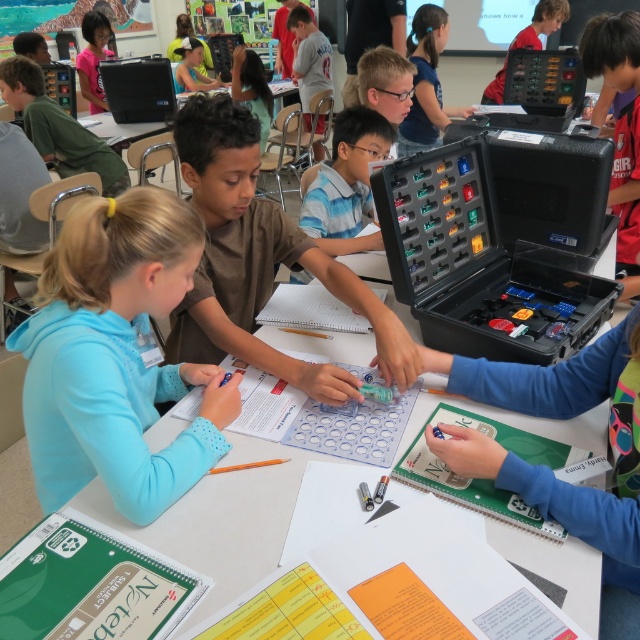
Question: Is blue fabric shirt at upper center below yellow-green fabric cap at upper center?

Choices:
 (A) no
 (B) yes

Answer: (B)

Question: Can you confirm if black plastic computer at upper left is thinner than matte green shirt at upper center?

Choices:
 (A) no
 (B) yes

Answer: (A)

Question: Which object appears farthest from the camera in this image?

Choices:
 (A) black plastic toolbox at center
 (B) blue tie-dye shirt at center
 (C) brown matte shirt at center
 (D) light blue fleece at center

Answer: (B)

Question: Which point appears farthest from the camera in this image?

Choices:
 (A) (134, 93)
 (B) (365, 136)

Answer: (A)

Question: Considering the relative positions of light blue fleece at center and yellow-green fabric cap at upper center in the image provided, where is light blue fleece at center located with respect to yellow-green fabric cap at upper center?

Choices:
 (A) below
 (B) above

Answer: (A)

Question: Considering the real-world distances, which object is closest to the light blue fleece at center?

Choices:
 (A) yellow-green fabric cap at upper center
 (B) matte black laptop at left

Answer: (B)